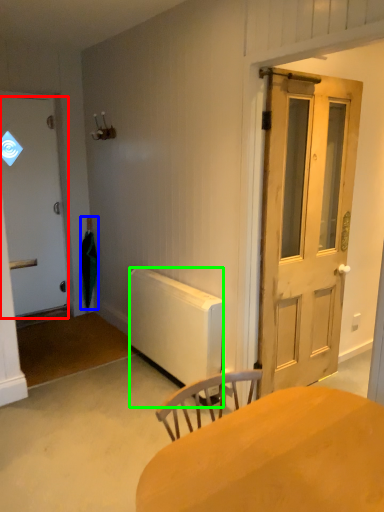
Question: Considering the real-world distances, which object is farthest from door (highlighted by a red box)? umbrella (highlighted by a blue box) or radiator (highlighted by a green box)?

Choices:
 (A) umbrella
 (B) radiator

Answer: (B)